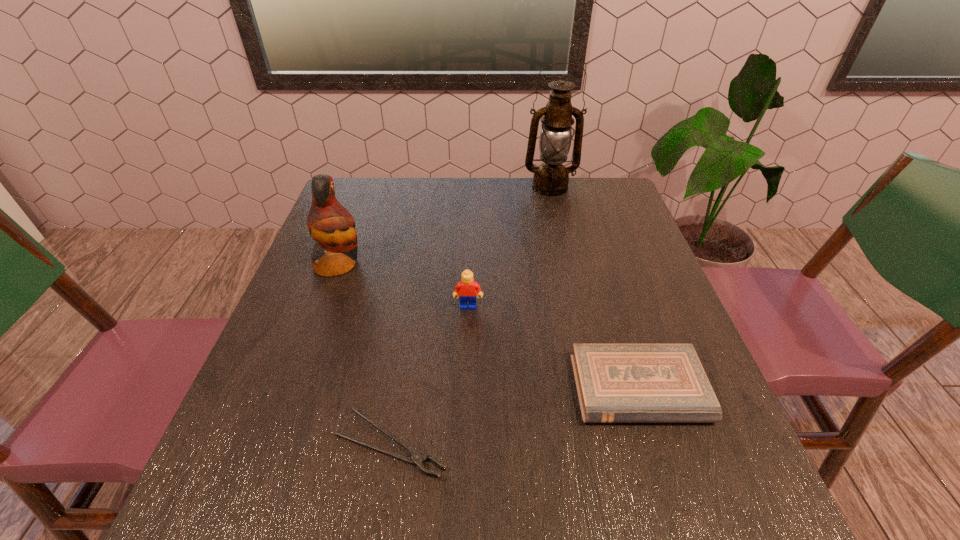
In the image, there is a desktop. Where is `vacant space at the near edge`? The width and height of the screenshot is (960, 540). vacant space at the near edge is located at coordinates (332, 520).

This screenshot has height=540, width=960. I want to click on vacant area at the left edge of the desktop, so click(313, 417).

Where is `vacant space at the right edge of the desktop`? The image size is (960, 540). vacant space at the right edge of the desktop is located at coordinates (671, 341).

At what (x,y) coordinates should I click in order to perform the action: click on vacant space at the far left corner of the desktop. Please return your answer as a coordinate pair (x, y). The image size is (960, 540). Looking at the image, I should click on (387, 208).

Identify the location of free point at the near right corner. (674, 516).

Find the location of a particular element. The width and height of the screenshot is (960, 540). empty space between the third farthest object and the fourth nearest object is located at coordinates (403, 285).

What are the coordinates of `free point between the third farthest object and the second farthest object` in the screenshot? It's located at (403, 285).

Where is `vacant space that's between the third shortest object and the farthest object`? The width and height of the screenshot is (960, 540). vacant space that's between the third shortest object and the farthest object is located at coordinates (509, 247).

This screenshot has width=960, height=540. I want to click on free spot between the third nearest object and the oil lamp, so click(x=509, y=247).

You are a GUI agent. You are given a task and a screenshot of the screen. Output one action in this format:
    pyautogui.click(x=<x>, y=<y>)
    Task: Click on the free point between the fourth nearest object and the tongs
    
    Given the screenshot: What is the action you would take?
    pyautogui.click(x=365, y=354)